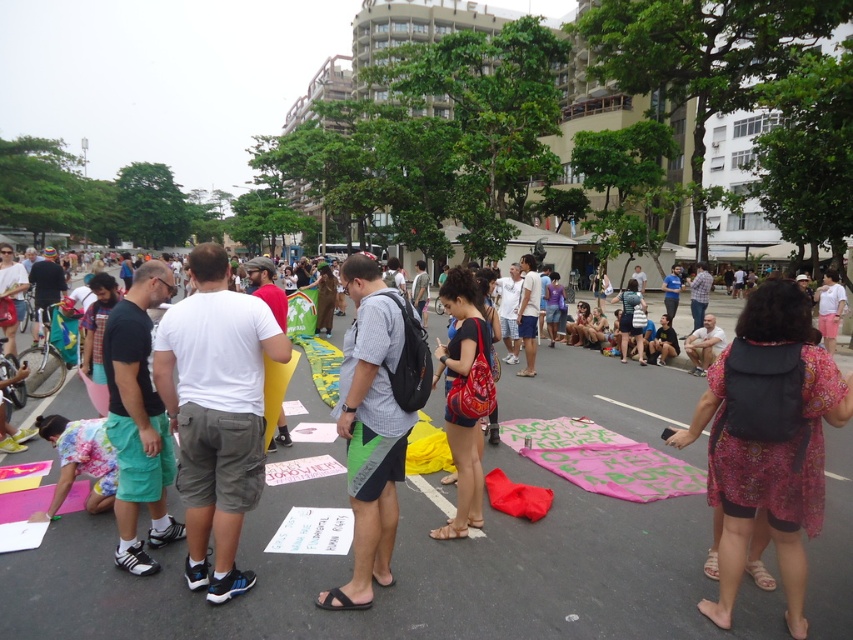
Question: Does white cotton t-shirt at center have a larger size compared to printed cotton dress at center?

Choices:
 (A) no
 (B) yes

Answer: (A)

Question: Which of the following is the farthest from the observer?

Choices:
 (A) checkered fabric shirt at center
 (B) white cotton t-shirt at center

Answer: (B)

Question: Is white cotton t-shirt at center positioned in front of printed cotton dress at center?

Choices:
 (A) no
 (B) yes

Answer: (A)

Question: Which is nearer to the printed cotton dress at center?

Choices:
 (A) white cotton t-shirt at center
 (B) checkered fabric shirt at center

Answer: (B)

Question: Which of the following is the closest to the observer?

Choices:
 (A) printed cotton dress at center
 (B) white cotton t-shirt at center
 (C) checkered fabric shirt at center

Answer: (A)

Question: Observing the image, what is the correct spatial positioning of white cotton t-shirt at center in reference to checkered fabric shirt at center?

Choices:
 (A) above
 (B) below

Answer: (A)